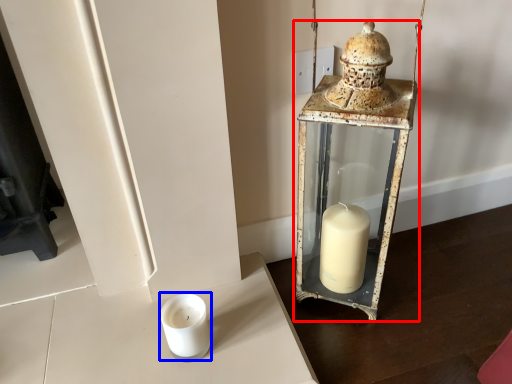
Question: Among these objects, which one is nearest to the camera, lantern (highlighted by a red box) or candle holder (highlighted by a blue box)?

Choices:
 (A) lantern
 (B) candle holder

Answer: (A)